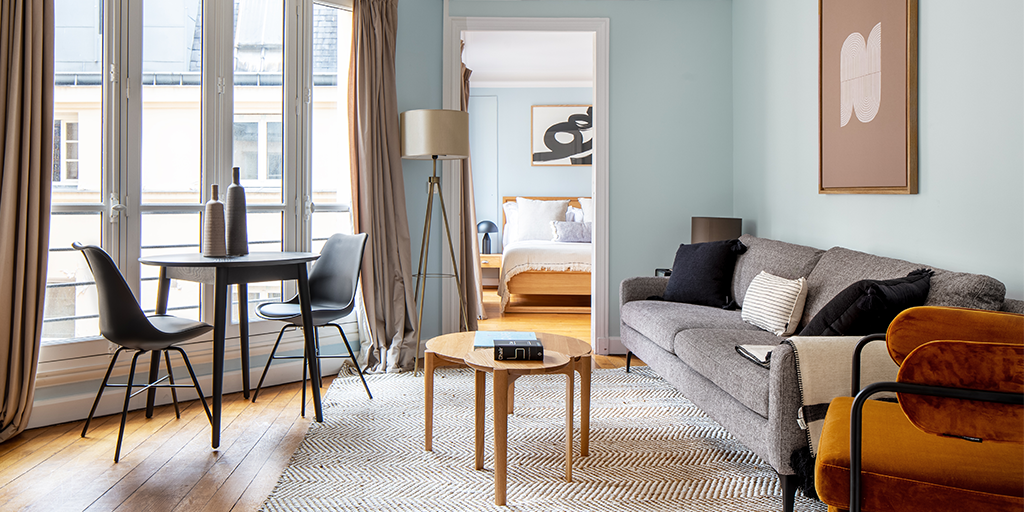
Where is `lamp`? lamp is located at coordinates (434, 134).